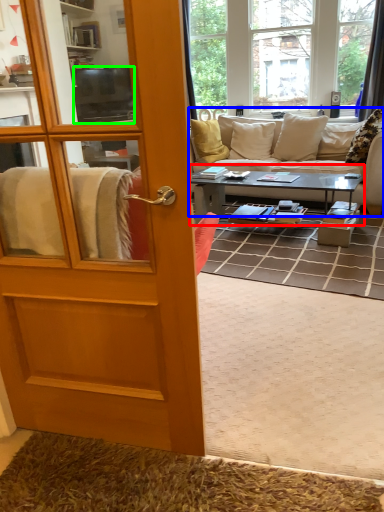
Question: Which object is the closest to the coffee table (highlighted by a red box)? Choose among these: studio couch (highlighted by a blue box) or television (highlighted by a green box).

Choices:
 (A) studio couch
 (B) television

Answer: (A)